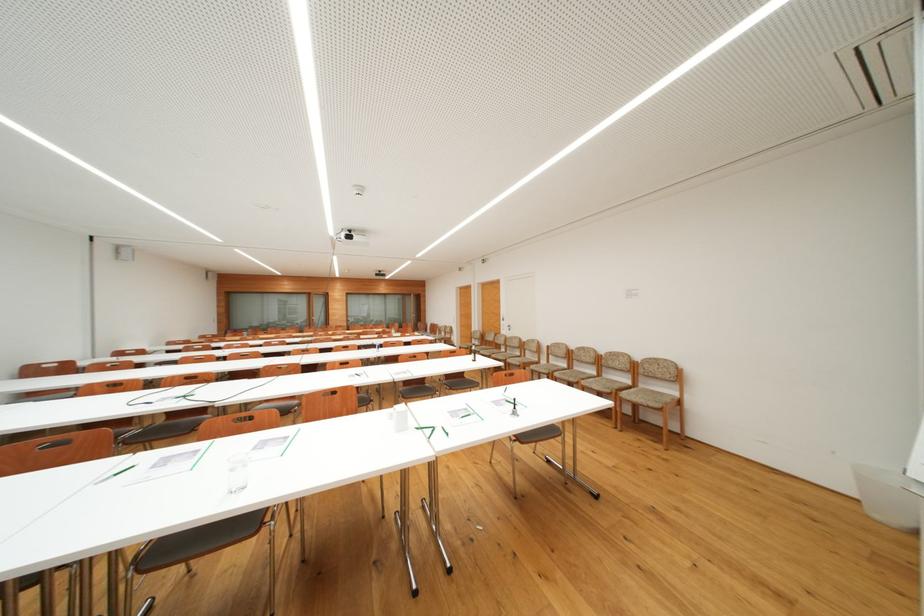
The height and width of the screenshot is (616, 924). What do you see at coordinates (504, 310) in the screenshot?
I see `the white door handle` at bounding box center [504, 310].